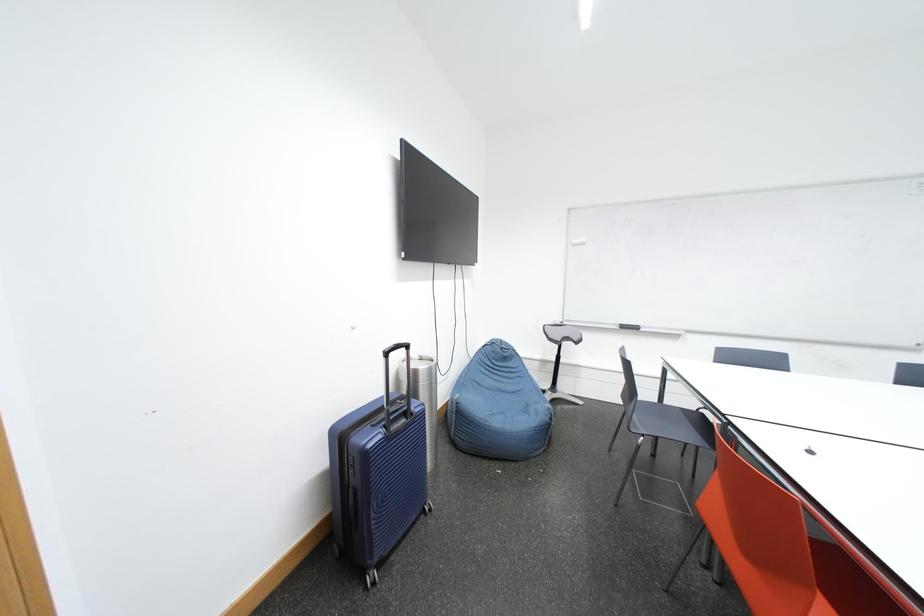
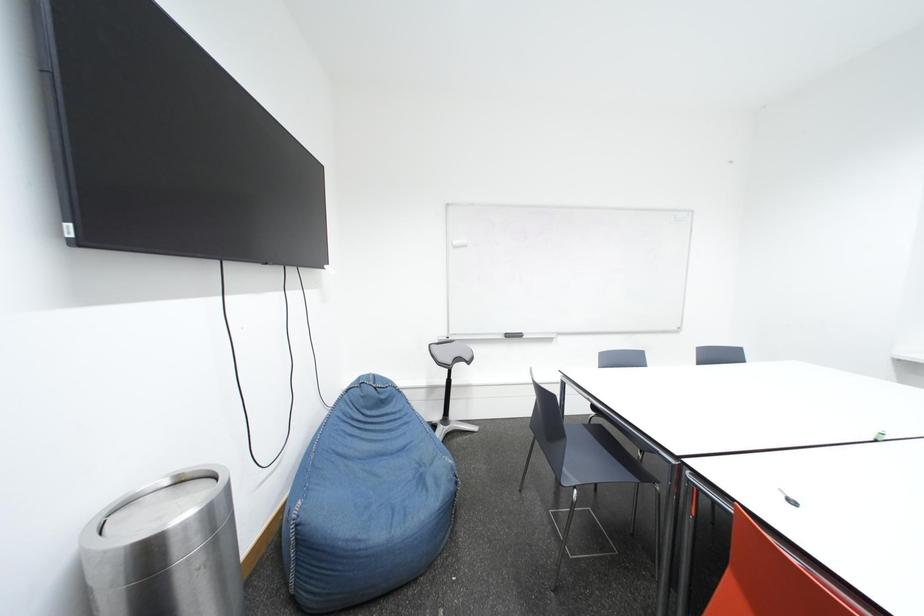
Question: What movement of the cameraman would produce the second image?

Choices:
 (A) Left
 (B) Right
 (C) Forward
 (D) Backward

Answer: (C)